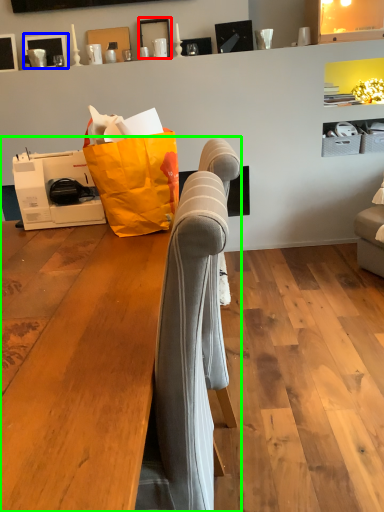
Question: Which object is positioned farthest from picture frame (highlighted by a red box)? Select from picture frame (highlighted by a blue box) and furniture (highlighted by a green box).

Choices:
 (A) picture frame
 (B) furniture

Answer: (B)